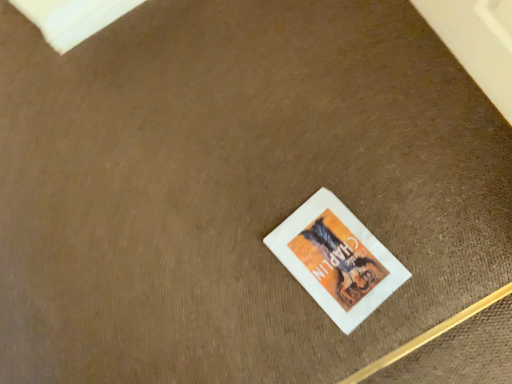
Identify the location of vacant area that is in front of white paper book at center. Image resolution: width=512 pixels, height=384 pixels. (402, 312).